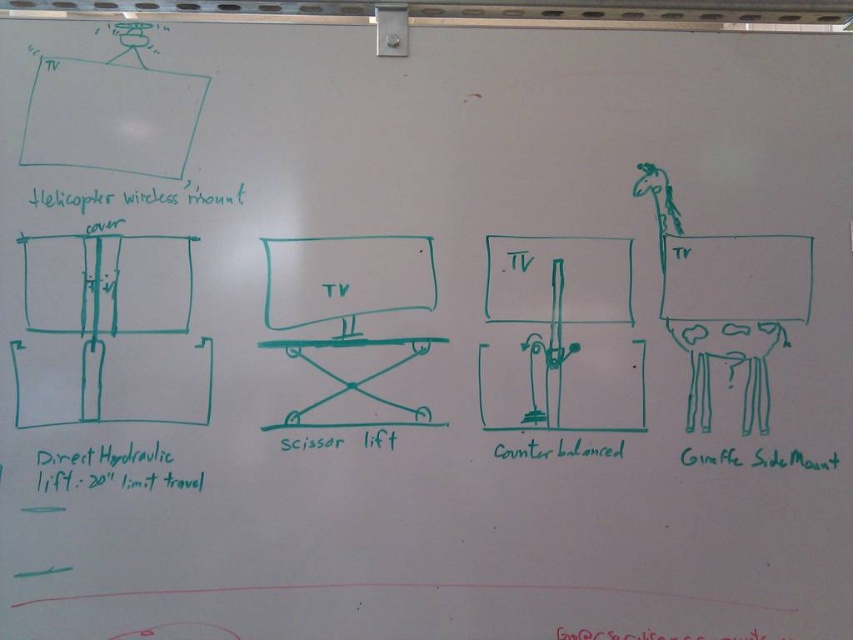
You are an engineer inspecting the whiteboard. You notice the direct hydraulic lift at lower left and the red ink writing at lower center. Which object on the whiteboard is taller?

The direct hydraulic lift at lower left is taller than the red ink writing at lower center.